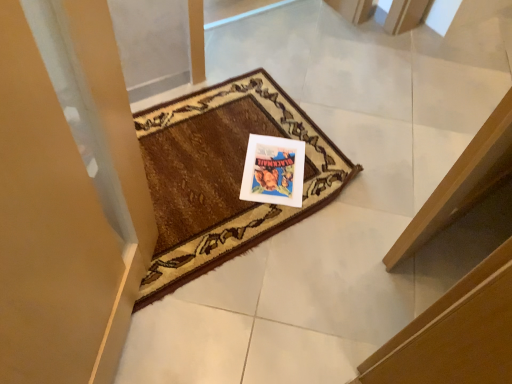
At what (x,y) coordinates should I click in order to perform the action: click on brown woven mat at center. Please return your answer as a coordinate pair (x, y). Image resolution: width=512 pixels, height=384 pixels. Looking at the image, I should click on (223, 175).

What do you see at coordinates (223, 175) in the screenshot?
I see `brown woven mat at center` at bounding box center [223, 175].

Locate an element on the screen. white glossy picture frame at center is located at coordinates (273, 171).

What do you see at coordinates (273, 171) in the screenshot?
I see `white glossy picture frame at center` at bounding box center [273, 171].

The height and width of the screenshot is (384, 512). I want to click on brown woven mat at center, so click(x=223, y=175).

Which object is positioned more to the left, white glossy picture frame at center or brown woven mat at center?

Positioned to the left is brown woven mat at center.

Considering their positions, is white glossy picture frame at center located in front of or behind brown woven mat at center?

white glossy picture frame at center is positioned farther from the viewer than brown woven mat at center.

Is point (298, 183) more distant than point (262, 112)?

That is False.

From the image's perspective, which is above, white glossy picture frame at center or brown woven mat at center?

brown woven mat at center appears higher in the image.

From a real-world perspective, is white glossy picture frame at center positioned over brown woven mat at center based on gravity?

No, from a real-world perspective, white glossy picture frame at center is not on top of brown woven mat at center.

In terms of width, does white glossy picture frame at center look wider or thinner when compared to brown woven mat at center?

In the image, white glossy picture frame at center appears to be more narrow than brown woven mat at center.

Which of these two, white glossy picture frame at center or brown woven mat at center, stands taller?

With more height is brown woven mat at center.

Can you confirm if white glossy picture frame at center is smaller than brown woven mat at center?

Correct, white glossy picture frame at center occupies less space than brown woven mat at center.

Is white glossy picture frame at center situated inside brown woven mat at center or outside?

white glossy picture frame at center is spatially positioned inside brown woven mat at center.

Are white glossy picture frame at center and brown woven mat at center far apart?

No, there isn't a large distance between white glossy picture frame at center and brown woven mat at center.

Is white glossy picture frame at center positioned with its back to brown woven mat at center?

Yes, white glossy picture frame at center is facing away from brown woven mat at center.

Image resolution: width=512 pixels, height=384 pixels. I want to click on picture frame below the brown woven mat at center (from a real-world perspective), so click(x=273, y=171).

Does brown woven mat at center appear on the right side of white glossy picture frame at center?

No.

Is brown woven mat at center further to the viewer compared to white glossy picture frame at center?

No, the depth of brown woven mat at center is less than that of white glossy picture frame at center.

Is point (203, 140) farther from viewer compared to point (293, 156)?

Yes, point (203, 140) is behind point (293, 156).

From the image's perspective, is brown woven mat at center below white glossy picture frame at center?

Actually, brown woven mat at center appears above white glossy picture frame at center in the image.

From a real-world perspective, which object stands above the other?

brown woven mat at center.

In terms of width, does brown woven mat at center look wider or thinner when compared to white glossy picture frame at center?

In the image, brown woven mat at center appears to be wider than white glossy picture frame at center.

In the scene shown: Considering the sizes of brown woven mat at center and white glossy picture frame at center in the image, is brown woven mat at center taller or shorter than white glossy picture frame at center?

Considering their sizes, brown woven mat at center has more height than white glossy picture frame at center.

Who is smaller, brown woven mat at center or white glossy picture frame at center?

white glossy picture frame at center is smaller.

Is white glossy picture frame at center completely or partially inside brown woven mat at center?

Yes, brown woven mat at center is surrounding white glossy picture frame at center.

From the picture: Is brown woven mat at center far from white glossy picture frame at center?

No.

Could you tell me if brown woven mat at center is facing white glossy picture frame at center?

Yes, brown woven mat at center is aimed at white glossy picture frame at center.

You are a GUI agent. You are given a task and a screenshot of the screen. Output one action in this format:
    pyautogui.click(x=<x>, y=<y>)
    Task: Click on the mat above the white glossy picture frame at center (from a real-world perspective)
    
    Given the screenshot: What is the action you would take?
    pyautogui.click(x=223, y=175)

Find the location of a particular element. picture frame that is behind the brown woven mat at center is located at coordinates (273, 171).

Locate an element on the screen. Image resolution: width=512 pixels, height=384 pixels. picture frame that appears below the brown woven mat at center (from the image's perspective) is located at coordinates (273, 171).